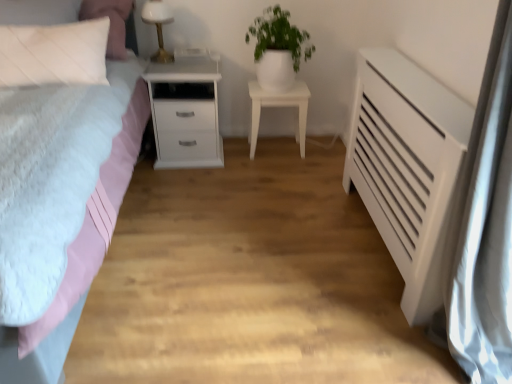
Find the location of a particular element. unoccupied area in front of white glossy nightstand at center, acting as the second nightstand starting from the left is located at coordinates (279, 172).